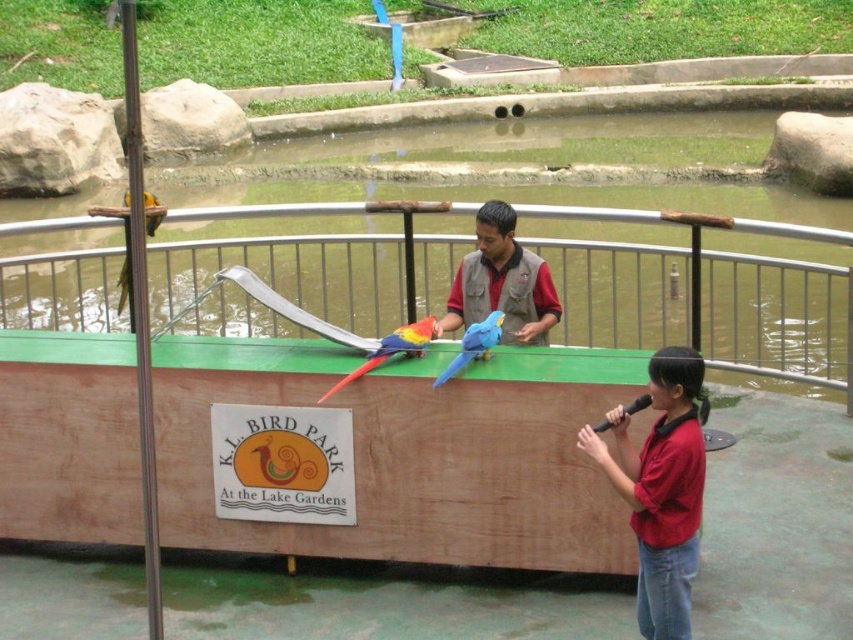
Question: Which point appears closest to the camera in this image?

Choices:
 (A) (527, 268)
 (B) (148, 192)
 (C) (467, 332)

Answer: (C)

Question: Which object appears farthest from the camera in this image?

Choices:
 (A) blue matte parrot at center
 (B) multicolored feathered parrot at center
 (C) matte red shirt at center
 (D) golden-yellow parrot at upper left

Answer: (B)

Question: Among these points, which one is farthest from the camera?

Choices:
 (A) (369, 355)
 (B) (776, 378)

Answer: (B)

Question: Does green painted metal railing at center appear under golden-yellow parrot at upper left?

Choices:
 (A) yes
 (B) no

Answer: (A)

Question: Is red shirt vest at center below multicolored feathered parrot at center?

Choices:
 (A) no
 (B) yes

Answer: (A)

Question: From the image, what is the correct spatial relationship of red shirt vest at center in relation to blue matte parrot at center?

Choices:
 (A) below
 (B) above

Answer: (B)